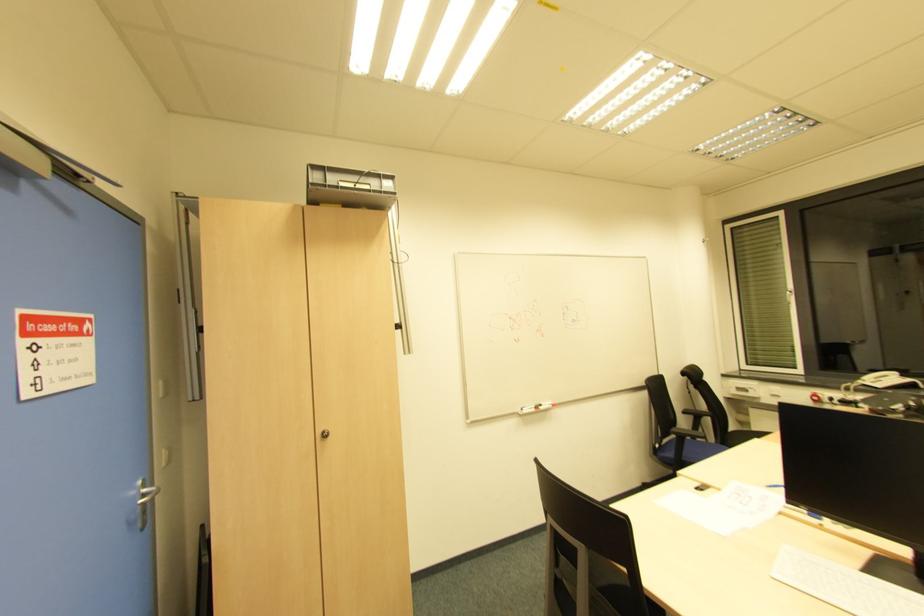
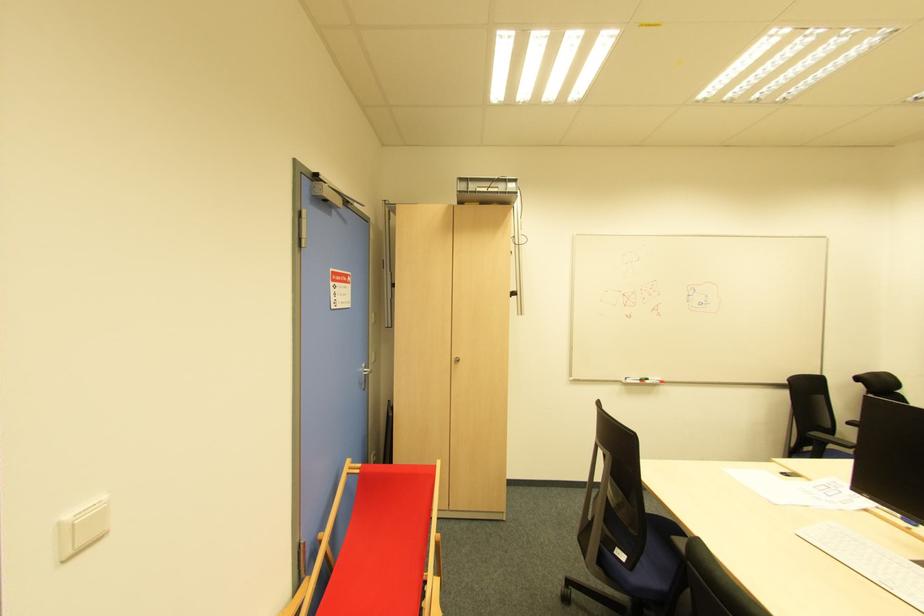
Find the pixel in the second image that matches (x=143, y=513) in the first image.

(366, 382)